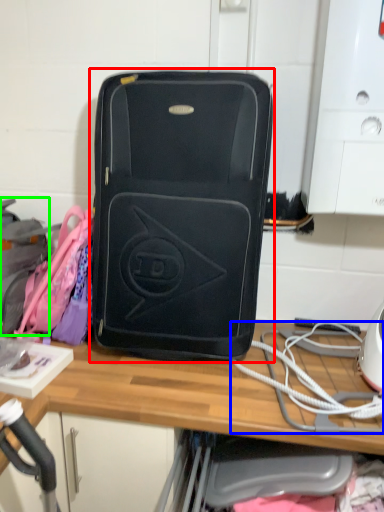
Question: Which object is positioned farthest from luggage and bags (highlighted by a red box)? Select from rope (highlighted by a blue box) and luggage (highlighted by a green box).

Choices:
 (A) rope
 (B) luggage

Answer: (B)